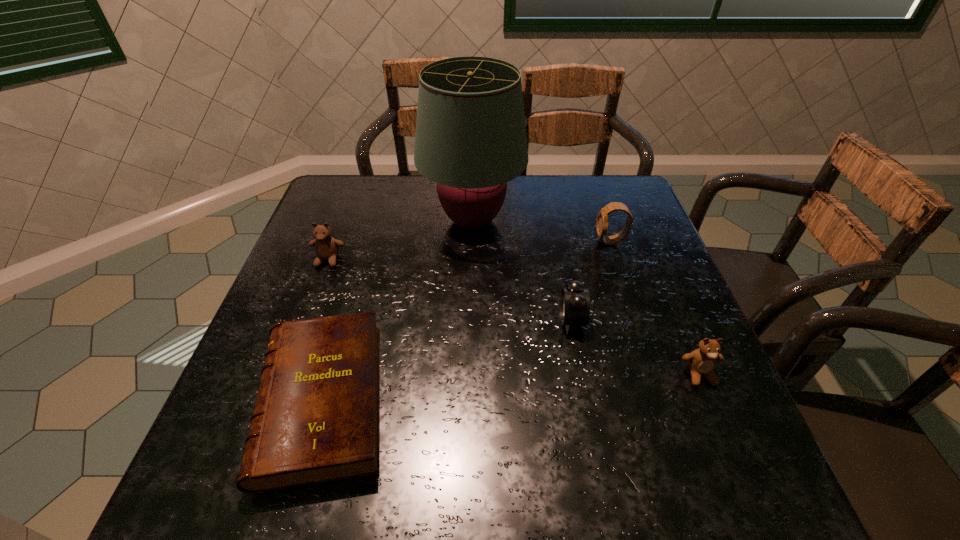
At what (x,y) coordinates should I click in order to perform the action: click on the closest object to the third object from left to right. Please return your answer as a coordinate pair (x, y). Looking at the image, I should click on (327, 247).

This screenshot has width=960, height=540. In order to click on blank space that satisfies the following two spatial constraints: 1. on the face of the watch; 2. on the front side of the shortest object in this screenshot , I will do `click(664, 401)`.

Locate an element on the screen. This screenshot has width=960, height=540. free space that satisfies the following two spatial constraints: 1. on the front-facing side of the shortest object; 2. on the left side of the farther teddy bear is located at coordinates (276, 401).